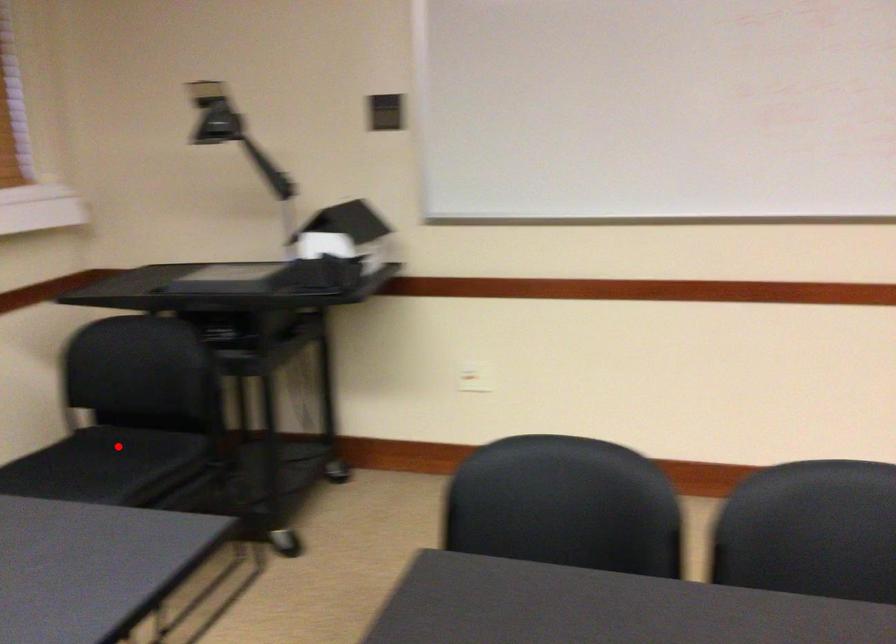
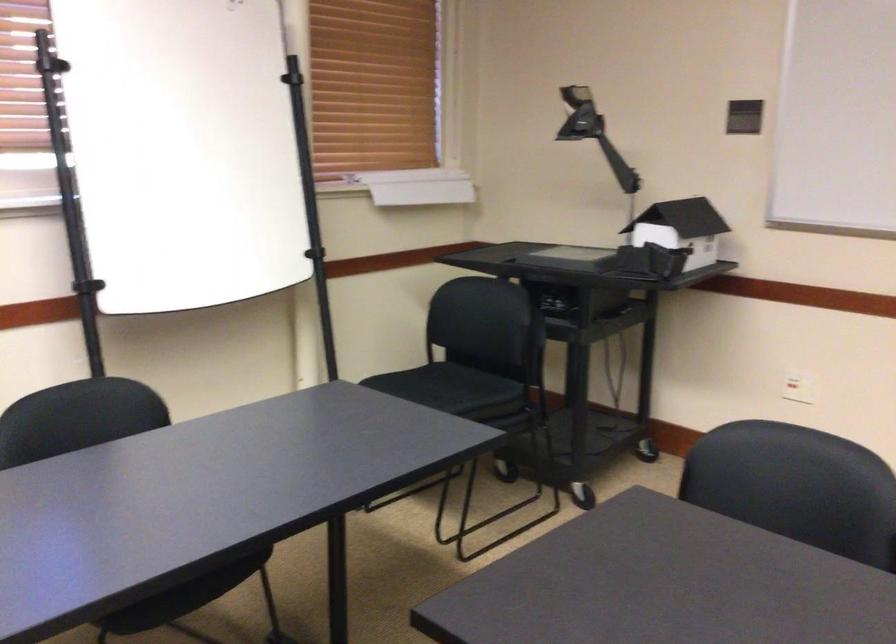
Find the pixel in the second image that matches the highlighted location in the first image.

(449, 383)